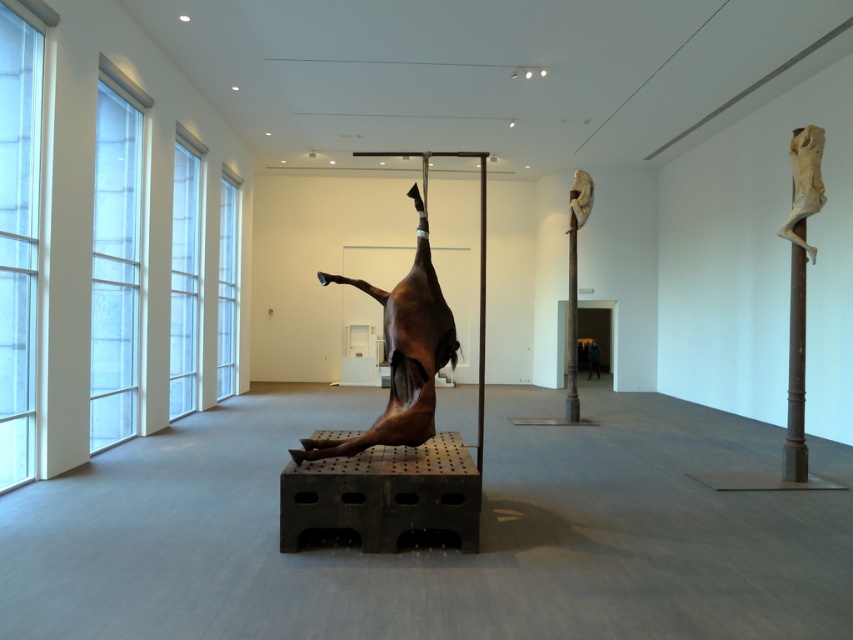
Who is lower down, shiny bronze horse at center or matte white figure at right?

shiny bronze horse at center is below.

Between shiny bronze horse at center and matte white figure at right, which one is positioned higher?

matte white figure at right is above.

Find the location of a particular element. The image size is (853, 640). shiny bronze horse at center is located at coordinates (402, 353).

Is shiny bronze horse at center closer to camera compared to dark blue jacket at center?

Yes.

Is point (425, 417) closer to viewer compared to point (587, 376)?

Yes, point (425, 417) is closer to viewer.

Identify the location of shiny bronze horse at center. (402, 353).

Who is higher up, matte white figure at right or dark blue jacket at center?

matte white figure at right is above.

Is matte white figure at right positioned in front of dark blue jacket at center?

Yes, matte white figure at right is closer to the viewer.

At what (x,y) coordinates should I click in order to perform the action: click on matte white figure at right. Please return your answer as a coordinate pair (x, y). The height and width of the screenshot is (640, 853). Looking at the image, I should click on (804, 182).

Locate an element on the screen. The height and width of the screenshot is (640, 853). matte white figure at right is located at coordinates (804, 182).